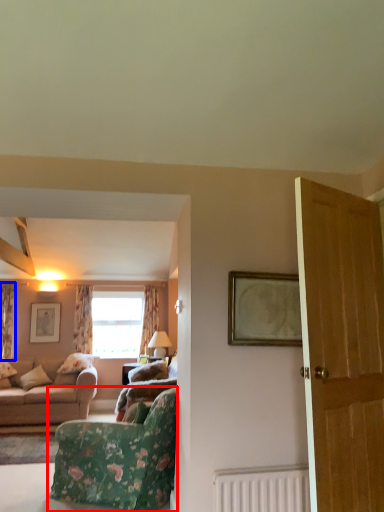
Question: Which point is closer to the camera, chair (highlighted by a red box) or curtain (highlighted by a blue box)?

Choices:
 (A) chair
 (B) curtain

Answer: (A)